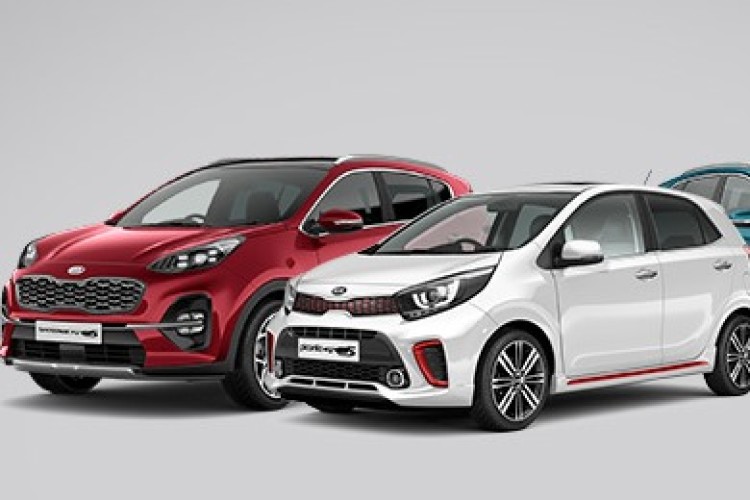
Identify the location of door handle. (646, 275), (723, 267).